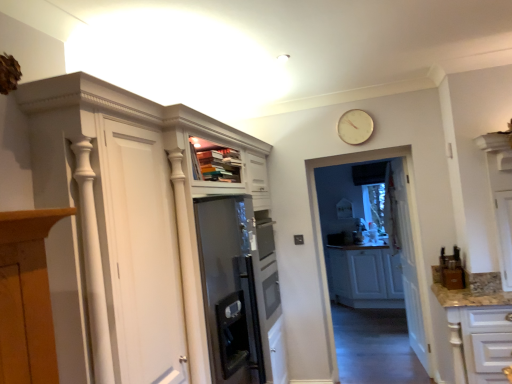
Measure the distance between white glossy cabinet at lower right, the 1th cabinetry when ordered from front to back, and camera.

The distance of white glossy cabinet at lower right, the 1th cabinetry when ordered from front to back, from camera is 8.90 feet.

Measure the distance between point (211, 342) and camera.

A distance of 2.16 meters exists between point (211, 342) and camera.

What is the approximate width of white wooden door at center?

white wooden door at center is 4.89 inches wide.

Find the location of a particular element. The height and width of the screenshot is (384, 512). white glossy cabinet at lower right, the 1th cabinetry when ordered from front to back is located at coordinates (478, 333).

Is white glossy cabinet at lower right, positioned as the second cabinetry in back-to-front order, beside white glossy cupboard at upper left?

They are not placed beside each other.

Looking at this image, is white glossy cabinet at lower right, the 1th cabinetry when ordered from front to back, aimed at white glossy cupboard at upper left?

No.

Is white glossy cabinet at lower right, the 1th cabinetry when ordered from front to back, closer to the viewer compared to white glossy cupboard at upper left?

No, white glossy cabinet at lower right, the 1th cabinetry when ordered from front to back, is further to the viewer.

Does white glossy cabinet at lower right, the 1th cabinetry when ordered from front to back, have a greater width compared to white glossy cupboard at upper left?

Indeed, white glossy cabinet at lower right, the 1th cabinetry when ordered from front to back, has a greater width compared to white glossy cupboard at upper left.

Could you tell me if gold metallic clock at upper center is turned towards transparent glass door at center?

No, gold metallic clock at upper center is not oriented towards transparent glass door at center.

Based on the photo, is gold metallic clock at upper center next to transparent glass door at center?

No, gold metallic clock at upper center is not in contact with transparent glass door at center.

Considering the relative sizes of gold metallic clock at upper center and transparent glass door at center in the image provided, is gold metallic clock at upper center wider than transparent glass door at center?

No, gold metallic clock at upper center is not wider than transparent glass door at center.

Is point (355, 135) farther from camera compared to point (399, 190)?

No, (355, 135) is closer to viewer.

Which of these two, white wooden door at center or white matte cabinet at center, the second cabinetry from the front, is bigger?

Bigger between the two is white matte cabinet at center, the second cabinetry from the front.

Based on the photo, is white wooden door at center oriented towards white matte cabinet at center, the first cabinetry from the back?

No.

Is white wooden door at center taller or shorter than white matte cabinet at center, the first cabinetry from the back?

In the image, white wooden door at center appears to be taller than white matte cabinet at center, the first cabinetry from the back.

From the image's perspective, which is above, white matte cabinet at center, the second cabinetry from the front, or white glossy cabinet at lower right, positioned as the second cabinetry in back-to-front order?

white glossy cabinet at lower right, positioned as the second cabinetry in back-to-front order.

Can you confirm if white matte cabinet at center, the second cabinetry from the front, is positioned to the right of white glossy cabinet at lower right, the 1th cabinetry when ordered from front to back?

Indeed, white matte cabinet at center, the second cabinetry from the front, is positioned on the right side of white glossy cabinet at lower right, the 1th cabinetry when ordered from front to back.

Can you confirm if white matte cabinet at center, the second cabinetry from the front, is smaller than white glossy cabinet at lower right, the 1th cabinetry when ordered from front to back?

Incorrect, white matte cabinet at center, the second cabinetry from the front, is not smaller in size than white glossy cabinet at lower right, the 1th cabinetry when ordered from front to back.

From the image's perspective, is white glossy cupboard at upper left on top of gold metallic clock at upper center?

No, from the image's perspective, white glossy cupboard at upper left is not above gold metallic clock at upper center.

Is point (57, 341) positioned behind point (339, 124)?

No, it is in front of (339, 124).

Can you confirm if white glossy cupboard at upper left is positioned to the left of gold metallic clock at upper center?

Indeed, white glossy cupboard at upper left is positioned on the left side of gold metallic clock at upper center.

Does transparent glass door at center have a greater height compared to white matte cabinet at center, the first cabinetry from the back?

Indeed, transparent glass door at center has a greater height compared to white matte cabinet at center, the first cabinetry from the back.

Is transparent glass door at center situated inside white matte cabinet at center, the second cabinetry from the front, or outside?

transparent glass door at center is not enclosed by white matte cabinet at center, the second cabinetry from the front.

Can you confirm if transparent glass door at center is thinner than white matte cabinet at center, the second cabinetry from the front?

Correct, the width of transparent glass door at center is less than that of white matte cabinet at center, the second cabinetry from the front.

How distant is transparent glass door at center from white matte cabinet at center, the second cabinetry from the front?

transparent glass door at center and white matte cabinet at center, the second cabinetry from the front, are 1.72 meters apart.

How different are the orientations of white wooden door at center and transparent glass door at center in degrees?

There is a 96.6-degree angle between the facing directions of white wooden door at center and transparent glass door at center.

Is white wooden door at center positioned beyond the bounds of transparent glass door at center?

Yes, white wooden door at center is located beyond the bounds of transparent glass door at center.

What are the coordinates of `door that is under the transparent glass door at center (from a real-world perspective)` in the screenshot? It's located at (405, 254).

Is white wooden door at center positioned with its back to transparent glass door at center?

white wooden door at center is not turned away from transparent glass door at center.

In the image, there is a white glossy cabinet at lower right, the 1th cabinetry when ordered from front to back. Identify the location of cupboard above it (from the image's perspective). The height and width of the screenshot is (384, 512). (154, 238).

The image size is (512, 384). I want to click on glass door behind the gold metallic clock at upper center, so click(x=400, y=239).

From the image, which object appears to be farther from white wooden door at center, white glossy cupboard at upper left or gold metallic clock at upper center?

white glossy cupboard at upper left is further to white wooden door at center.

Looking at the image, which one is located closer to white glossy cabinet at lower right, the 1th cabinetry when ordered from front to back, gold metallic clock at upper center or transparent glass door at center?

Based on the image, transparent glass door at center appears to be nearer to white glossy cabinet at lower right, the 1th cabinetry when ordered from front to back.

Considering their positions, is white matte cabinet at center, the second cabinetry from the front, positioned closer to transparent glass door at center than white glossy cupboard at upper left?

white matte cabinet at center, the second cabinetry from the front, is positioned closer to the anchor transparent glass door at center.

Estimate the real-world distances between objects in this image. Which object is further from gold metallic clock at upper center, white wooden door at center or transparent glass door at center?

white wooden door at center is further to gold metallic clock at upper center.

When comparing their distances from white glossy cabinet at lower right, the 1th cabinetry when ordered from front to back, does white glossy cupboard at upper left or white wooden door at center seem closer?

white wooden door at center.

Looking at this image, based on their spatial positions, is white matte cabinet at center, the second cabinetry from the front, or transparent glass door at center closer to gold metallic clock at upper center?

The object closer to gold metallic clock at upper center is transparent glass door at center.

From the image, which object appears to be farther from transparent glass door at center, white matte cabinet at center, the second cabinetry from the front, or white wooden door at center?

white matte cabinet at center, the second cabinetry from the front, is further to transparent glass door at center.

Looking at the image, which one is located closer to white glossy cupboard at upper left, white matte cabinet at center, the second cabinetry from the front, or white glossy cabinet at lower right, positioned as the second cabinetry in back-to-front order?

Among the two, white glossy cabinet at lower right, positioned as the second cabinetry in back-to-front order, is located nearer to white glossy cupboard at upper left.

Where is `door between white glossy cabinet at lower right, the 1th cabinetry when ordered from front to back, and white matte cabinet at center, the second cabinetry from the front, along the z-axis`? door between white glossy cabinet at lower right, the 1th cabinetry when ordered from front to back, and white matte cabinet at center, the second cabinetry from the front, along the z-axis is located at coordinates (405, 254).

Find the location of a particular element. The width and height of the screenshot is (512, 384). glass door between white glossy cabinet at lower right, the 1th cabinetry when ordered from front to back, and white matte cabinet at center, the first cabinetry from the back, along the z-axis is located at coordinates (400, 239).

Where is `clock between white glossy cabinet at lower right, the 1th cabinetry when ordered from front to back, and white matte cabinet at center, the first cabinetry from the back, along the z-axis`? This screenshot has height=384, width=512. clock between white glossy cabinet at lower right, the 1th cabinetry when ordered from front to back, and white matte cabinet at center, the first cabinetry from the back, along the z-axis is located at coordinates (355, 127).

In order to click on cabinetry located between white glossy cupboard at upper left and white wooden door at center in the depth direction in this screenshot , I will do `click(478, 333)`.